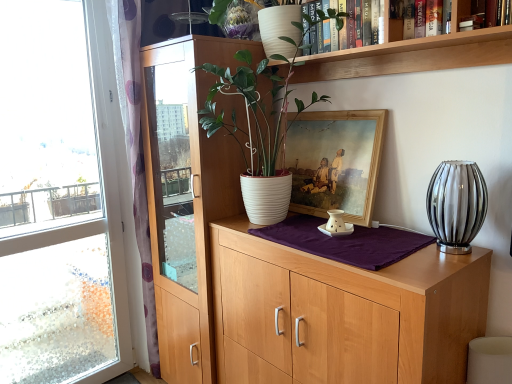
Question: Is translucent glass vase at right thinner than wooden framed painting at center?

Choices:
 (A) no
 (B) yes

Answer: (A)

Question: Does translucent glass vase at right have a lesser height compared to wooden framed painting at center?

Choices:
 (A) yes
 (B) no

Answer: (A)

Question: Is translucent glass vase at right not near wooden framed painting at center?

Choices:
 (A) yes
 (B) no

Answer: (B)

Question: Is translucent glass vase at right in front of wooden framed painting at center?

Choices:
 (A) no
 (B) yes

Answer: (B)

Question: Does translucent glass vase at right touch wooden framed painting at center?

Choices:
 (A) yes
 (B) no

Answer: (B)

Question: Considering the relative sizes of translucent glass vase at right and wooden framed painting at center in the image provided, is translucent glass vase at right taller than wooden framed painting at center?

Choices:
 (A) yes
 (B) no

Answer: (B)

Question: From a real-world perspective, is transparent glass window at left under hardcover book at upper right, marked as the 3th book in a back-to-front arrangement?

Choices:
 (A) yes
 (B) no

Answer: (A)

Question: Does transparent glass window at left have a lesser width compared to hardcover book at upper right, which is the third book in left-to-right order?

Choices:
 (A) no
 (B) yes

Answer: (A)

Question: Considering the relative sizes of transparent glass window at left and hardcover book at upper right, marked as the first book in a right-to-left arrangement, in the image provided, is transparent glass window at left taller than hardcover book at upper right, marked as the first book in a right-to-left arrangement,?

Choices:
 (A) yes
 (B) no

Answer: (A)

Question: From the image's perspective, would you say transparent glass window at left is positioned over hardcover book at upper right, marked as the first book in a right-to-left arrangement?

Choices:
 (A) no
 (B) yes

Answer: (A)

Question: Does transparent glass window at left have a lesser height compared to hardcover book at upper right, which is the third book in left-to-right order?

Choices:
 (A) no
 (B) yes

Answer: (A)

Question: Is transparent glass window at left touching hardcover book at upper right, marked as the 3th book in a back-to-front arrangement?

Choices:
 (A) no
 (B) yes

Answer: (A)

Question: Is white ribbed pot at center in front of transparent glass window at left?

Choices:
 (A) yes
 (B) no

Answer: (A)